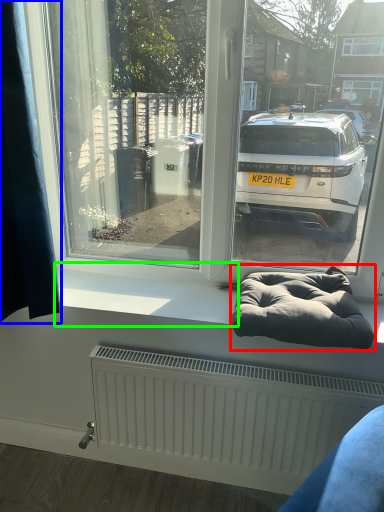
Question: Which is farther away from bean bag chair (highlighted by a red box)? curtain (highlighted by a blue box) or window sill (highlighted by a green box)?

Choices:
 (A) curtain
 (B) window sill

Answer: (A)